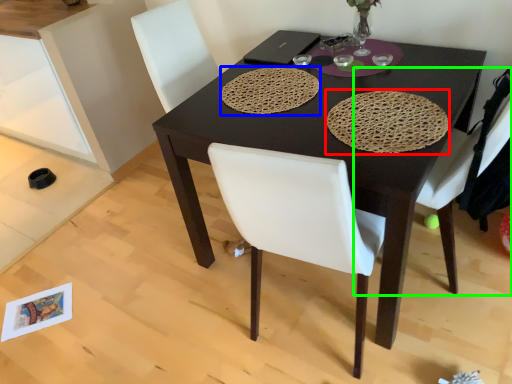
Question: Which object is the farthest from mat (highlighted by a red box)? Choose among these: mat (highlighted by a blue box) or chair (highlighted by a green box).

Choices:
 (A) mat
 (B) chair

Answer: (A)